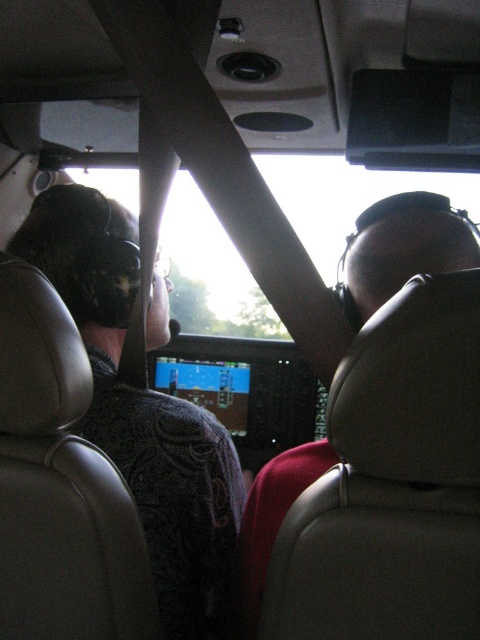
You are a flight attendant observing the cockpit from the backseat. You notice two matte black helmets. Which one is closer to you, the matte black helmet at left or the matte black helmet at right?

The matte black helmet at left is closer to you because the matte black helmet at right is positioned behind it.

Looking at this image, you are a flight attendant checking the helmets in the cockpit. You need to determine which helmet is bigger between the matte black helmet at left and the matte black helmet at right. Which one is larger?

The matte black helmet at left is larger compared to the matte black helmet at right.

You are a flight attendant observing the cockpit from the backseat. You notice two matte black helmets in your view. Which helmet is positioned higher in the cockpit, the matte black helmet at left or the matte black helmet at right?

The matte black helmet at left is located above the matte black helmet at right, so the matte black helmet at left is positioned higher in the cockpit.